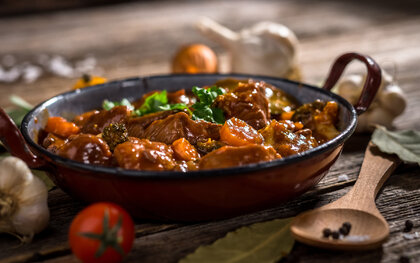
Locate an element on the screen. This screenshot has height=263, width=420. leaves on table is located at coordinates (405, 158), (261, 231).